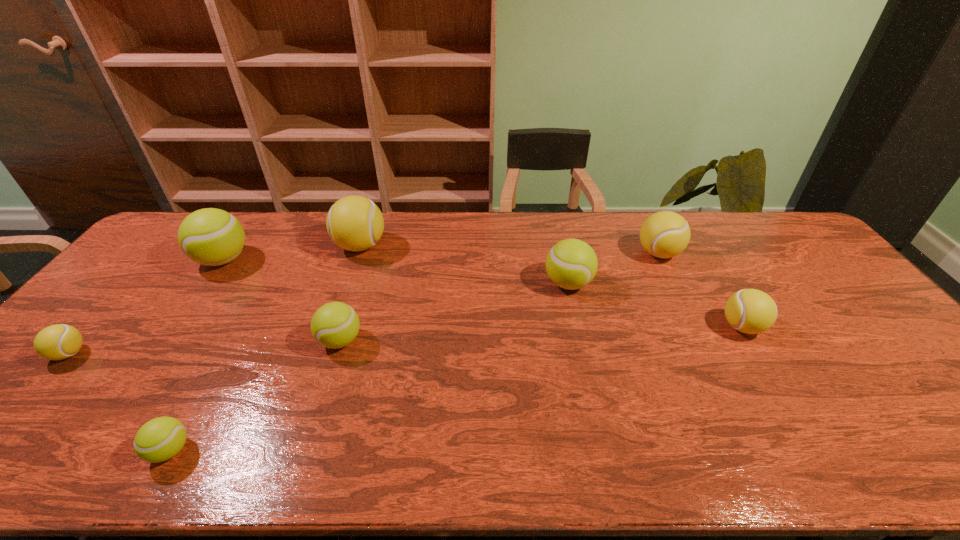
Identify the location of the biggest green tennis ball. The image size is (960, 540). (212, 237).

Image resolution: width=960 pixels, height=540 pixels. What are the coordinates of `the second tennis ball from left to right` in the screenshot? It's located at (212, 237).

Locate an element on the screen. This screenshot has height=540, width=960. the second yellow tennis ball from left to right is located at coordinates (355, 223).

Find the location of a particular element. the second biggest yellow tennis ball is located at coordinates (665, 234).

Where is `the second biggest green tennis ball`? the second biggest green tennis ball is located at coordinates (571, 264).

What are the coordinates of `the sixth object from left to right` in the screenshot? It's located at click(571, 264).

The height and width of the screenshot is (540, 960). What are the coordinates of `the third green tennis ball from left to right` in the screenshot? It's located at (334, 325).

Where is `the second smallest green tennis ball`? The image size is (960, 540). the second smallest green tennis ball is located at coordinates (334, 325).

Locate an element on the screen. the second smallest yellow tennis ball is located at coordinates (751, 311).

Identify the location of the leftmost yellow tennis ball. The image size is (960, 540). click(60, 341).